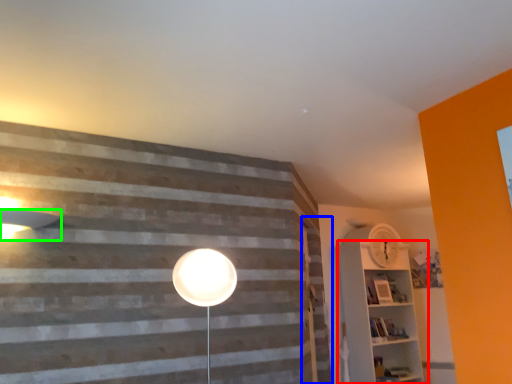
Question: Which object is the closest to the shelf (highlighted by a red box)? Choose among these: barn door (highlighted by a blue box) or lamp (highlighted by a green box).

Choices:
 (A) barn door
 (B) lamp

Answer: (A)